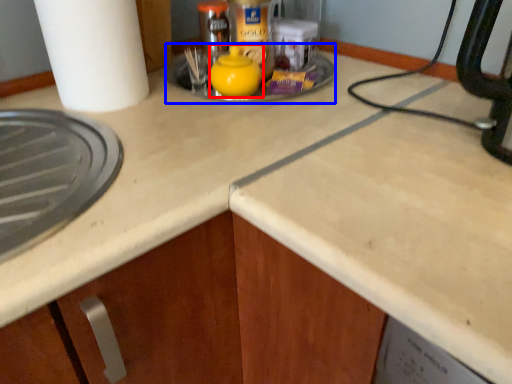
Question: Which of the following is the closest to the observer, tea pot (highlighted by a red box) or sink (highlighted by a blue box)?

Choices:
 (A) tea pot
 (B) sink

Answer: (A)